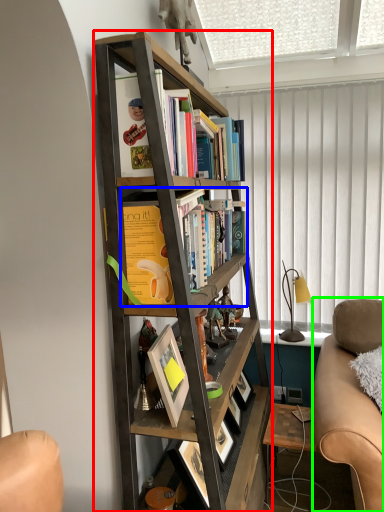
Question: Which object is positioned closest to bookcase (highlighted by a red box)? Select from book (highlighted by a blue box) and studio couch (highlighted by a green box).

Choices:
 (A) book
 (B) studio couch

Answer: (A)